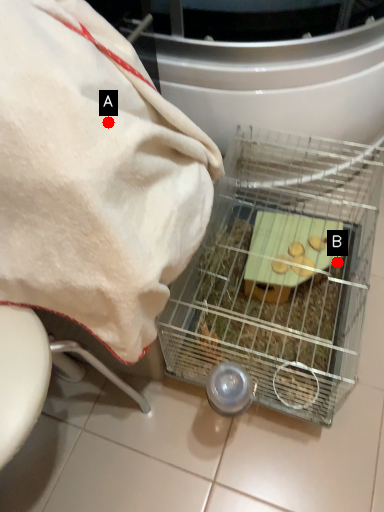
Question: Two points are circled on the image, labeled by A and B beside each circle. Which point appears farthest from the camera in this image?

Choices:
 (A) A is further
 (B) B is further

Answer: (B)